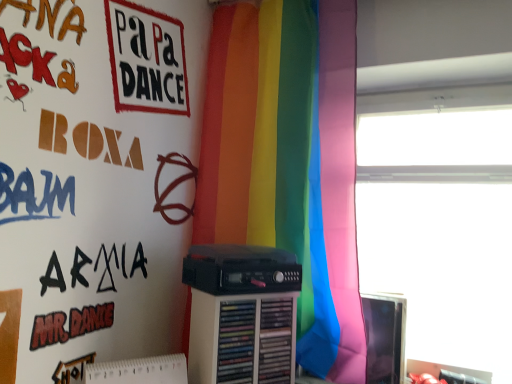
Locate an element on the screen. Image resolution: width=512 pixels, height=384 pixels. rainbow fabric curtain at center is located at coordinates pyautogui.click(x=289, y=160).

You are a GUI agent. You are given a task and a screenshot of the screen. Output one action in this format:
    pyautogui.click(x=<x>, y=<y>)
    Task: Click on the matte black monitor at right
    
    Given the screenshot: What is the action you would take?
    pyautogui.click(x=385, y=338)

Based on their positions, is matte black monitor at right located to the left or right of transparent glass window at upper right?

Clearly, matte black monitor at right is on the left of transparent glass window at upper right in the image.

Are matte black monitor at right and transparent glass window at upper right making contact?

There is a gap between matte black monitor at right and transparent glass window at upper right.

Is matte black monitor at right aimed at transparent glass window at upper right?

Yes.

Could you tell me if black plastic cassette at center is facing matte black monitor at right?

No, black plastic cassette at center is not facing towards matte black monitor at right.

Does black plastic cassette at center come behind matte black monitor at right?

No, the depth of black plastic cassette at center is less than that of matte black monitor at right.

From a real-world perspective, is black plastic cassette at center under matte black monitor at right?

Answer: No, from a real-world perspective, black plastic cassette at center is not beneath matte black monitor at right.

Which of these two, black plastic cassette at center or matte black monitor at right, is bigger?

With larger size is black plastic cassette at center.

From the image's perspective, between black plastic cassette at center and transparent glass window at upper right, who is located below?

black plastic cassette at center.

From a real-world perspective, is black plastic cassette at center physically below transparent glass window at upper right?

Correct, in the physical world, black plastic cassette at center is lower than transparent glass window at upper right.

Is transparent glass window at upper right at the back of black plastic cassette at center?

No, black plastic cassette at center is not facing the opposite direction of transparent glass window at upper right.

What's the angular difference between black plastic cassette at center and rainbow fabric curtain at center's facing directions?

The angular difference between black plastic cassette at center and rainbow fabric curtain at center is 58.9 degrees.

Is black plastic cassette at center far from rainbow fabric curtain at center?

black plastic cassette at center is near rainbow fabric curtain at center, not far away.

Does black plastic cassette at center turn towards rainbow fabric curtain at center?

No.

Is black plastic cassette at center inside the boundaries of rainbow fabric curtain at center, or outside?

The correct answer is: outside.

Is matte black monitor at right located outside rainbow fabric curtain at center?

Yes, matte black monitor at right is outside of rainbow fabric curtain at center.

Considering the positions of objects matte black monitor at right and rainbow fabric curtain at center in the image provided, who is behind, matte black monitor at right or rainbow fabric curtain at center?

matte black monitor at right is more distant.

Is matte black monitor at right bigger than rainbow fabric curtain at center?

Incorrect, matte black monitor at right is not larger than rainbow fabric curtain at center.

Which is in front, point (376, 371) or point (224, 230)?

The point (376, 371) is more forward.

Which point is more forward, (341,188) or (388,365)?

The point (341,188) is in front.

From the image's perspective, is rainbow fabric curtain at center beneath matte black monitor at right?

Actually, rainbow fabric curtain at center appears above matte black monitor at right in the image.

Is rainbow fabric curtain at center positioned with its back to matte black monitor at right?

That's not correct — rainbow fabric curtain at center is not looking away from matte black monitor at right.

From a real-world perspective, is rainbow fabric curtain at center on matte black monitor at right?

Yes, from a real-world perspective, rainbow fabric curtain at center is on top of matte black monitor at right.

Could you tell me if transparent glass window at upper right is facing black plastic cassette at center?

No, transparent glass window at upper right is not aimed at black plastic cassette at center.

Consider the image. Is transparent glass window at upper right situated inside black plastic cassette at center or outside?

transparent glass window at upper right is spatially situated outside black plastic cassette at center.

Consider the image. From a real-world perspective, relative to black plastic cassette at center, is transparent glass window at upper right vertically above or below?

In terms of real-world spatial position, transparent glass window at upper right is above black plastic cassette at center.

At what (x,y) coordinates should I click in order to perform the action: click on computer monitor below the transparent glass window at upper right (from the image's perspective). Please return your answer as a coordinate pair (x, y). Looking at the image, I should click on (385, 338).

At what (x,y) coordinates should I click in order to perform the action: click on cassette on the left of the matte black monitor at right. Please return your answer as a coordinate pair (x, y). Looking at the image, I should click on tap(241, 269).

From the image, which object appears to be farther from transparent glass window at upper right, rainbow fabric curtain at center or black plastic cassette at center?

black plastic cassette at center lies further to transparent glass window at upper right than the other object.

Based on their spatial positions, is transparent glass window at upper right or matte black monitor at right further from black plastic cassette at center?

The object further to black plastic cassette at center is transparent glass window at upper right.

Considering their positions, is matte black monitor at right positioned further to black plastic cassette at center than transparent glass window at upper right?

Among the two, transparent glass window at upper right is located further to black plastic cassette at center.

When comparing their distances from transparent glass window at upper right, does matte black monitor at right or rainbow fabric curtain at center seem closer?

Based on the image, matte black monitor at right appears to be nearer to transparent glass window at upper right.

Based on the photo, looking at the image, which one is located further to rainbow fabric curtain at center, transparent glass window at upper right or matte black monitor at right?

matte black monitor at right.

Based on the photo, considering their positions, is rainbow fabric curtain at center positioned further to black plastic cassette at center than matte black monitor at right?

matte black monitor at right lies further to black plastic cassette at center than the other object.

Based on their spatial positions, is transparent glass window at upper right or rainbow fabric curtain at center further from black plastic cassette at center?

Among the two, transparent glass window at upper right is located further to black plastic cassette at center.

Estimate the real-world distances between objects in this image. Which object is further from transparent glass window at upper right, black plastic cassette at center or rainbow fabric curtain at center?

black plastic cassette at center is positioned further to the anchor transparent glass window at upper right.

Locate an element on the screen. curtain located between black plastic cassette at center and transparent glass window at upper right in the left-right direction is located at coordinates (289, 160).

What are the coordinates of `computer monitor between rainbow fabric curtain at center and transparent glass window at upper right` in the screenshot? It's located at (385, 338).

The image size is (512, 384). I want to click on computer monitor located between black plastic cassette at center and transparent glass window at upper right in the left-right direction, so click(385, 338).

This screenshot has width=512, height=384. Identify the location of cassette between rainbow fabric curtain at center and matte black monitor at right from top to bottom. (241, 269).